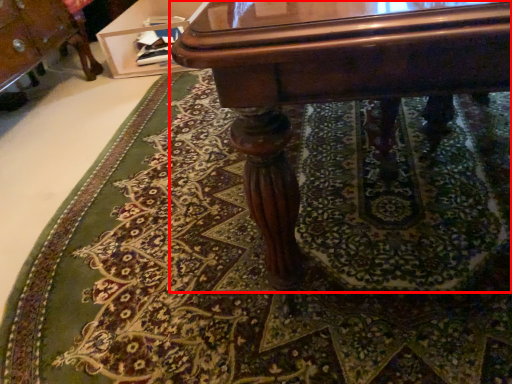
Question: From the image's perspective, considering the relative positions of table (annotated by the red box) and vanity in the image provided, where is table (annotated by the red box) located with respect to the staircase?

Choices:
 (A) above
 (B) below

Answer: (B)